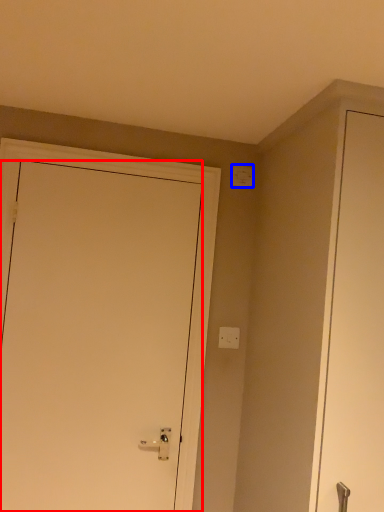
Question: Which object is closer to the camera taking this photo, door (highlighted by a red box) or light switch (highlighted by a blue box)?

Choices:
 (A) door
 (B) light switch

Answer: (A)